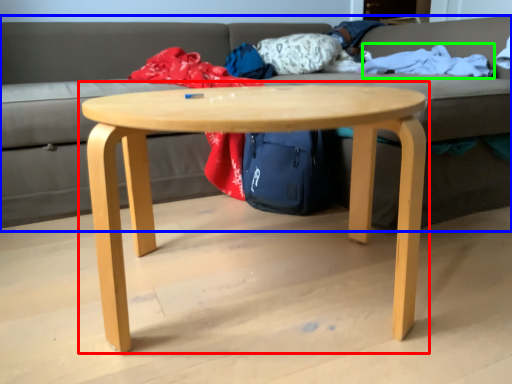
Question: Which is farther away from coffee table (highlighted by a red box)? studio couch (highlighted by a blue box) or blanket (highlighted by a green box)?

Choices:
 (A) studio couch
 (B) blanket

Answer: (A)